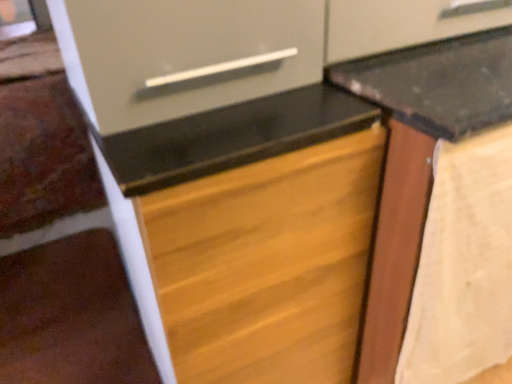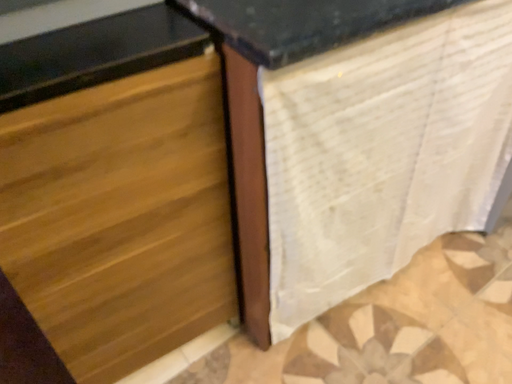
Question: Which way did the camera rotate in the video?

Choices:
 (A) rotated upward
 (B) rotated downward

Answer: (B)